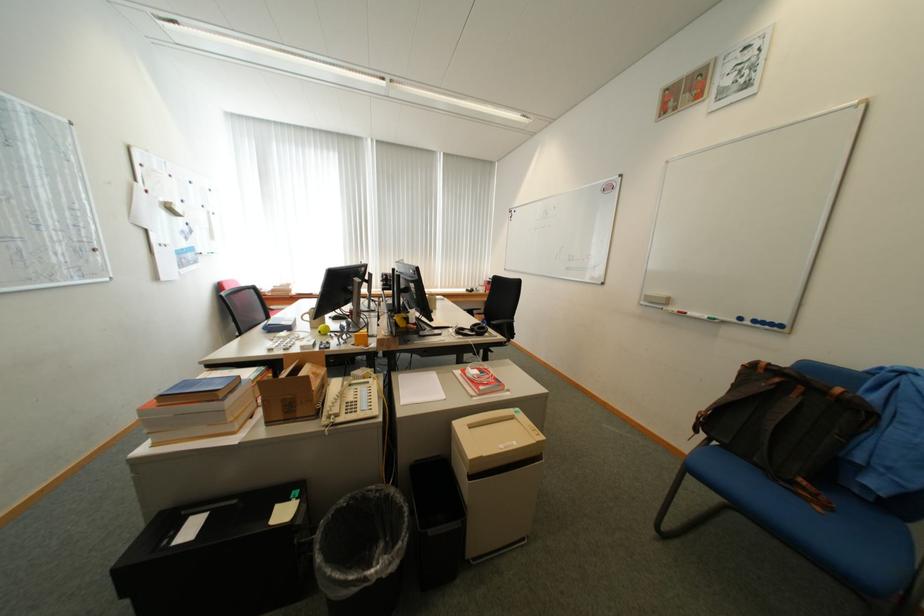
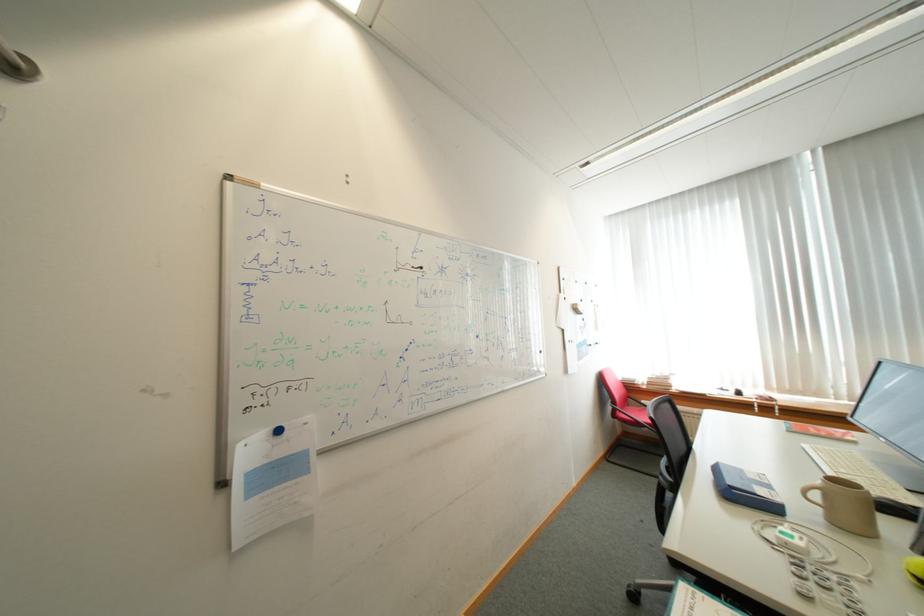
Question: The camera is either moving clockwise (left) or counter-clockwise (right) around the object. The first image is from the beginning of the video and the second image is from the end. Is the camera moving left or right when shooting the video?

Choices:
 (A) Left
 (B) Right

Answer: (B)